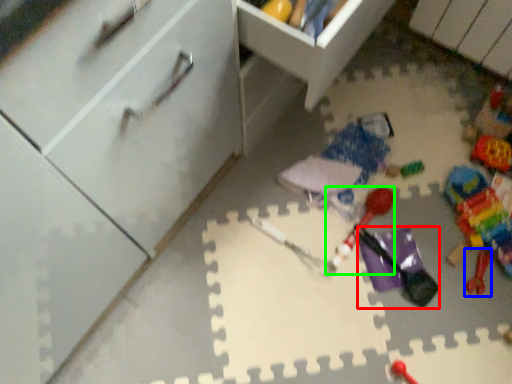
Question: Estimate the real-world distances between objects in this image. Which object is farther from toy (highlighted by a red box), toy (highlighted by a blue box) or toy (highlighted by a green box)?

Choices:
 (A) toy
 (B) toy

Answer: (A)